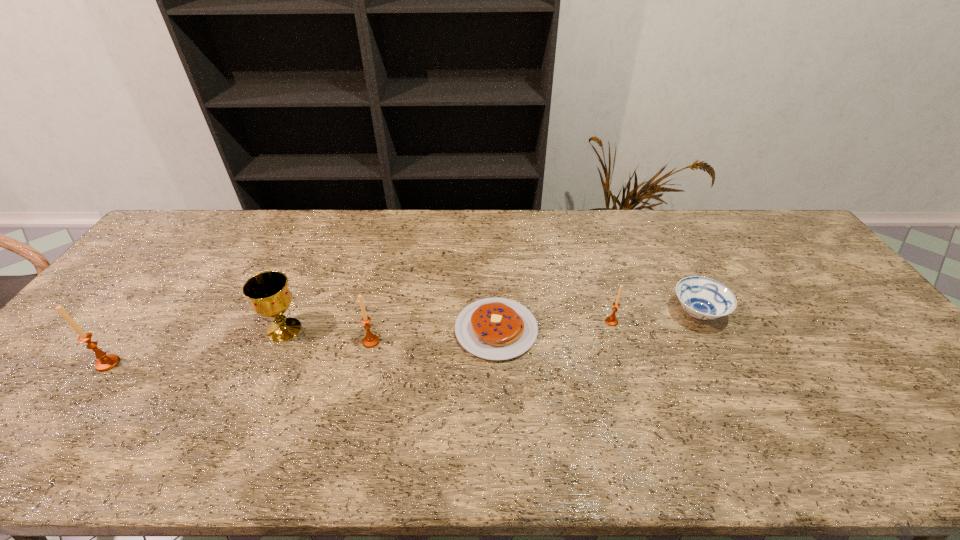
Where is `vacant space at the left edge of the desktop`? vacant space at the left edge of the desktop is located at coordinates (41, 387).

Locate an element on the screen. free spot at the right edge of the desktop is located at coordinates (801, 273).

You are a GUI agent. You are given a task and a screenshot of the screen. Output one action in this format:
    pyautogui.click(x=<x>, y=<y>)
    Task: Click on the free space at the far right corner of the desktop
    
    Given the screenshot: What is the action you would take?
    pyautogui.click(x=768, y=248)

Where is `vacant space in between the rightmost object and the shortest object`? The height and width of the screenshot is (540, 960). vacant space in between the rightmost object and the shortest object is located at coordinates (597, 321).

Where is `free space that is in between the fourth object from right to left and the tallest object`? free space that is in between the fourth object from right to left and the tallest object is located at coordinates (239, 353).

Locate an element on the screen. The height and width of the screenshot is (540, 960). vacant space that's between the tallest object and the rightmost candle_holder is located at coordinates (360, 342).

This screenshot has width=960, height=540. I want to click on vacant area that lies between the leftmost object and the rightmost object, so click(402, 338).

The width and height of the screenshot is (960, 540). Find the location of `free space that is in between the second shortest object and the pancake`. free space that is in between the second shortest object and the pancake is located at coordinates (597, 321).

In order to click on empty space that is in between the second tallest candle_holder and the fifth object from right to left in this screenshot , I will do `click(327, 336)`.

Where is `vacant area that lies between the rightmost candle_holder and the fourth object from left to right`? The image size is (960, 540). vacant area that lies between the rightmost candle_holder and the fourth object from left to right is located at coordinates (554, 326).